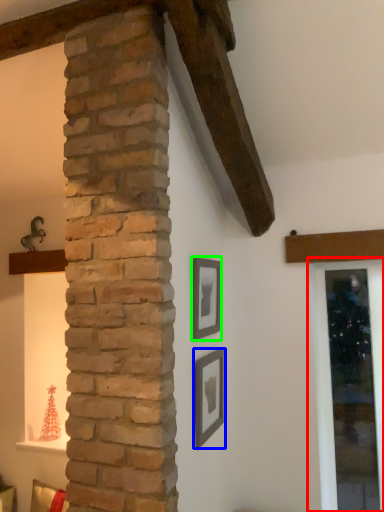
Question: Which is farther away from window frame (highlighted by a red box)? picture frame (highlighted by a blue box) or picture frame (highlighted by a green box)?

Choices:
 (A) picture frame
 (B) picture frame

Answer: (B)